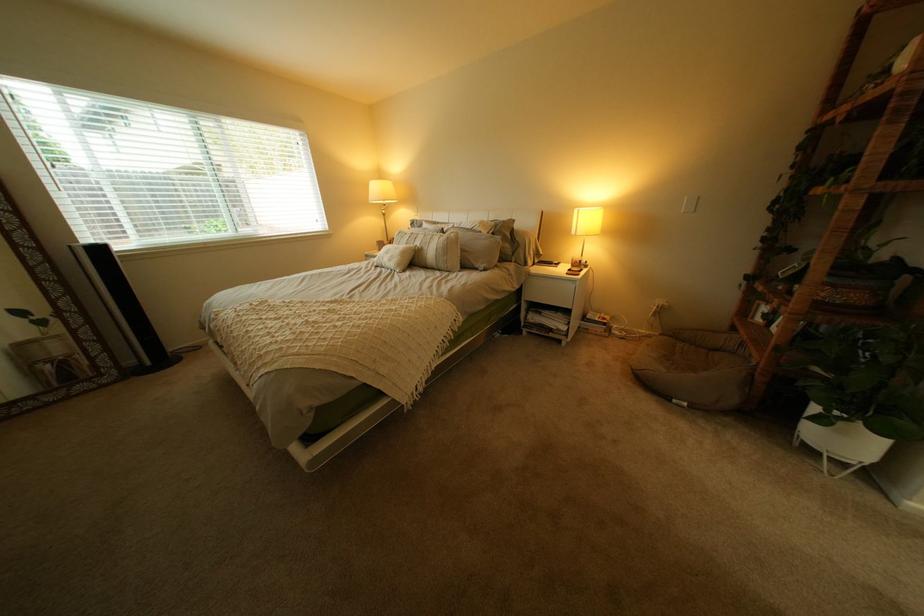
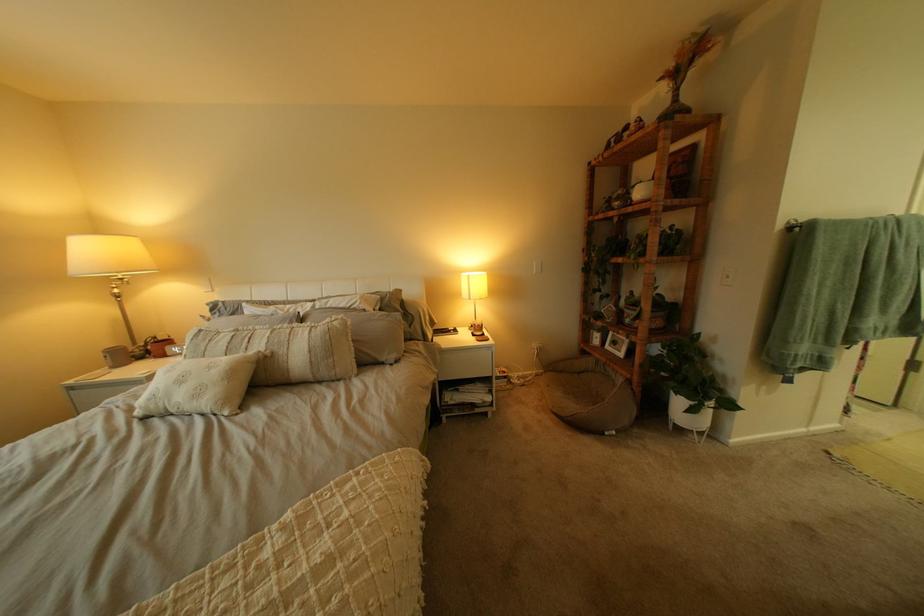
Locate, in the second image, the point that corresponds to the point at 392,245 in the first image.

(116, 357)